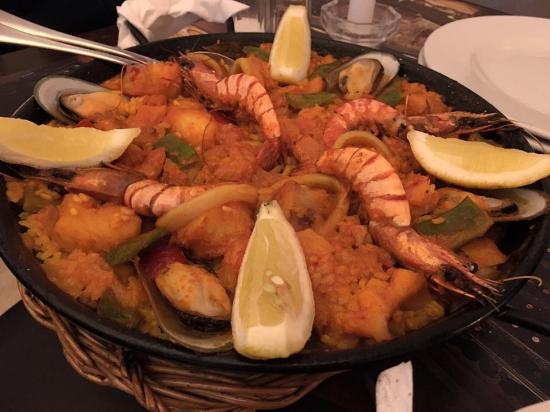
At what (x,y) coordinates should I click in order to perform the action: click on candle. Please return your answer as a coordinate pair (x, y). Looking at the image, I should click on (365, 13).